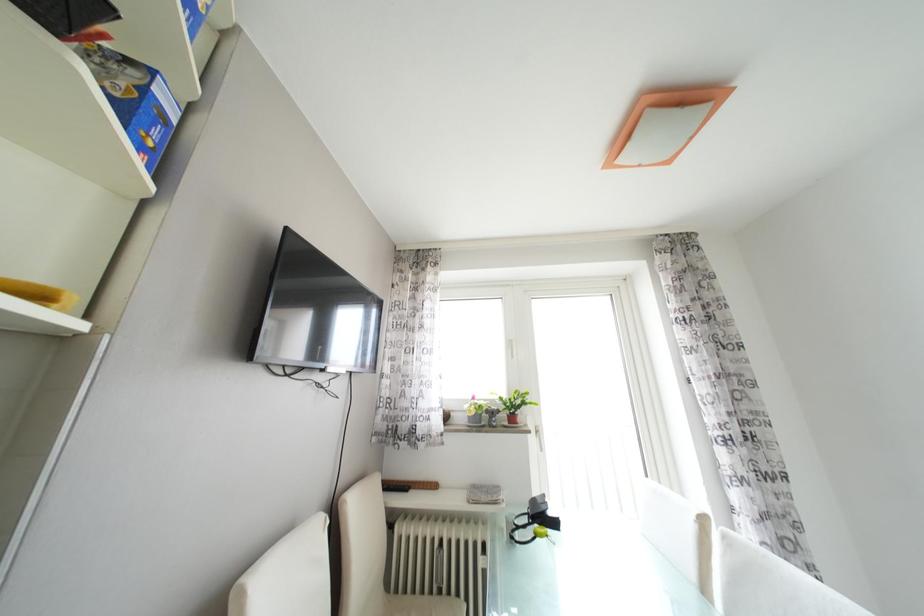
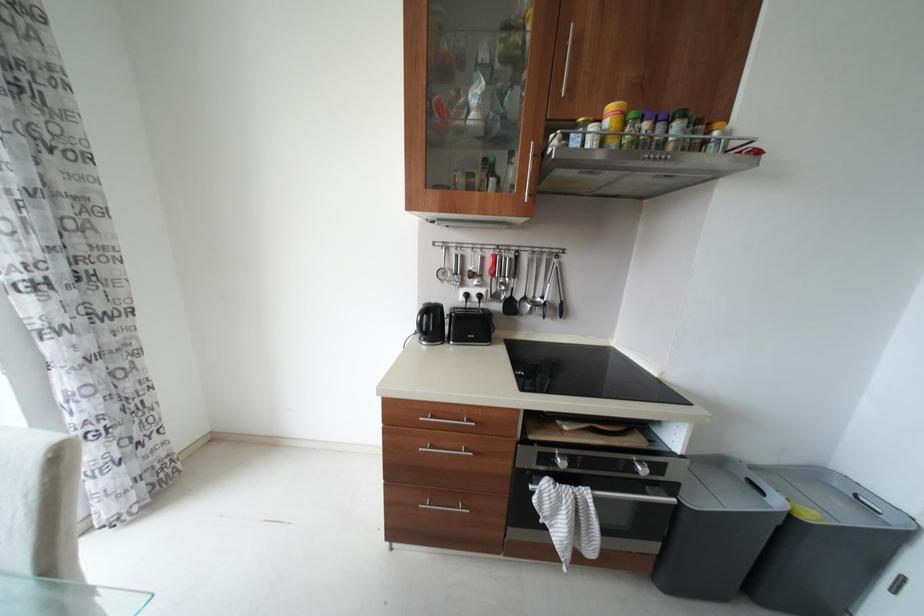
Question: The camera is either moving clockwise (left) or counter-clockwise (right) around the object. The first image is from the beginning of the video and the second image is from the end. Is the camera moving left or right when shooting the video?

Choices:
 (A) Left
 (B) Right

Answer: (A)